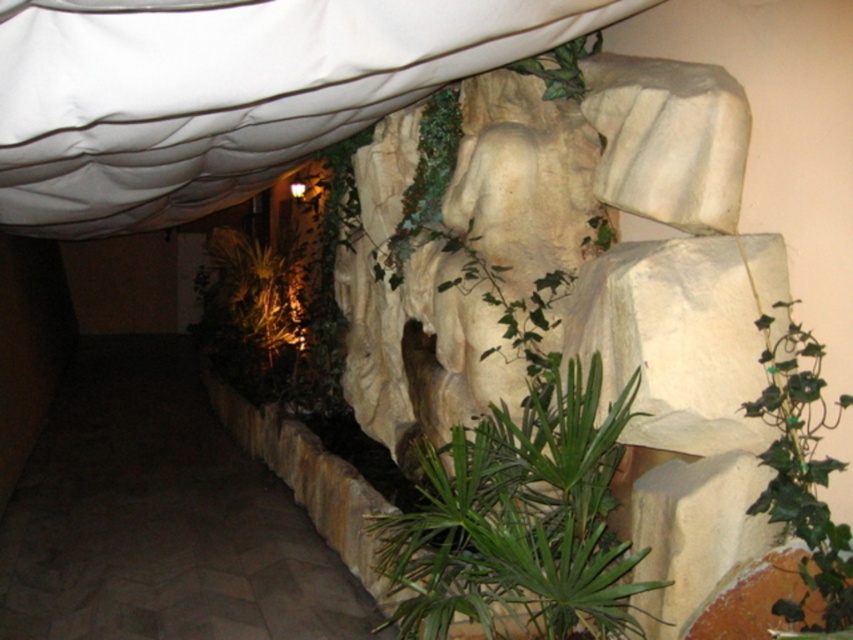
Who is more forward, (825, 618) or (438, 104)?

Point (825, 618) is more forward.

Is green leafy ivy at upper right above green ivy at center?

No, green leafy ivy at upper right is not above green ivy at center.

Locate an element on the screen. The width and height of the screenshot is (853, 640). green leafy ivy at upper right is located at coordinates (804, 477).

Find the location of `green leafy ivy at upper right`. green leafy ivy at upper right is located at coordinates (804, 477).

What do you see at coordinates (519, 522) in the screenshot? I see `green leafy plant at center` at bounding box center [519, 522].

Can you confirm if green leafy plant at center is positioned to the right of green leafy ivy at upper right?

In fact, green leafy plant at center is to the left of green leafy ivy at upper right.

Who is more forward, (547, 580) or (816, 538)?

Point (816, 538) is more forward.

Where is `green leafy plant at center`? green leafy plant at center is located at coordinates (519, 522).

Does brown stone pathway at lower left have a lesser width compared to green ivy at center?

In fact, brown stone pathway at lower left might be wider than green ivy at center.

Can you confirm if brown stone pathway at lower left is smaller than green ivy at center?

Correct, brown stone pathway at lower left occupies less space than green ivy at center.

Who is more forward, (x=225, y=477) or (x=386, y=276)?

Positioned in front is point (x=386, y=276).

At what (x,y) coordinates should I click in order to perform the action: click on brown stone pathway at lower left. Please return your answer as a coordinate pair (x, y). Looking at the image, I should click on pos(160,518).